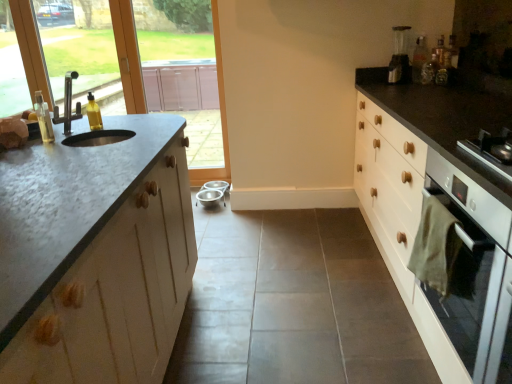
Question: Considering the relative sizes of metallic stainless steel bowls at center and white glossy oven at right in the image provided, is metallic stainless steel bowls at center thinner than white glossy oven at right?

Choices:
 (A) no
 (B) yes

Answer: (B)

Question: From a real-world perspective, is metallic stainless steel bowls at center beneath white glossy oven at right?

Choices:
 (A) yes
 (B) no

Answer: (A)

Question: Does metallic stainless steel bowls at center have a larger size compared to white glossy oven at right?

Choices:
 (A) yes
 (B) no

Answer: (B)

Question: Is metallic stainless steel bowls at center surrounding white glossy oven at right?

Choices:
 (A) yes
 (B) no

Answer: (B)

Question: Could you tell me if metallic stainless steel bowls at center is facing white glossy oven at right?

Choices:
 (A) no
 (B) yes

Answer: (A)

Question: Can you confirm if metallic stainless steel bowls at center is smaller than white glossy oven at right?

Choices:
 (A) no
 (B) yes

Answer: (B)

Question: Is yellow translucent bottle at left, the 2th bottle when ordered from back to front, next to metallic silver coffee machine at upper right and touching it?

Choices:
 (A) no
 (B) yes

Answer: (A)

Question: Can you confirm if yellow translucent bottle at left, which is counted as the second bottle, starting from the left, is bigger than metallic silver coffee machine at upper right?

Choices:
 (A) yes
 (B) no

Answer: (B)

Question: Is the position of yellow translucent bottle at left, arranged as the second bottle when viewed from the front, more distant than that of metallic silver coffee machine at upper right?

Choices:
 (A) yes
 (B) no

Answer: (B)

Question: Does yellow translucent bottle at left, arranged as the second bottle when viewed from the front, appear on the right side of metallic silver coffee machine at upper right?

Choices:
 (A) yes
 (B) no

Answer: (B)

Question: Could metallic silver coffee machine at upper right be considered to be inside yellow translucent bottle at left, which is counted as the second bottle, starting from the left?

Choices:
 (A) no
 (B) yes

Answer: (A)

Question: From the image's perspective, is yellow translucent bottle at left, the second bottle in the bottom-to-top sequence, below metallic silver coffee machine at upper right?

Choices:
 (A) yes
 (B) no

Answer: (A)

Question: From the image's perspective, does white glossy oven at right appear higher than matte glass window screen at upper left, which is counted as the 2th window screen, starting from the left?

Choices:
 (A) yes
 (B) no

Answer: (B)